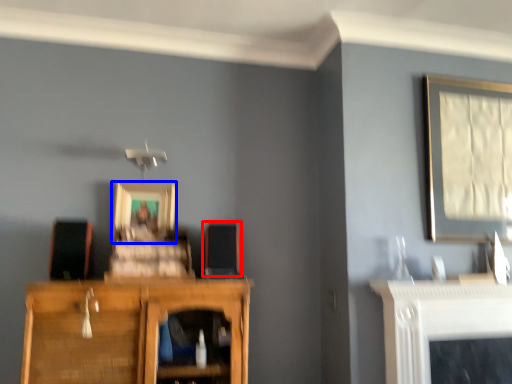
Question: Which of the following is the farthest to the observer, speaker (highlighted by a red box) or picture frame (highlighted by a blue box)?

Choices:
 (A) speaker
 (B) picture frame

Answer: (B)